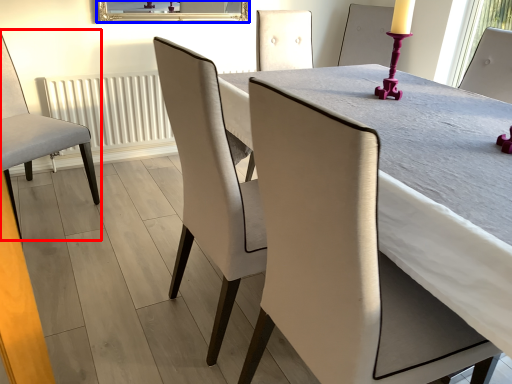
Question: Which object appears farthest to the camera in this image, chair (highlighted by a red box) or mirror (highlighted by a blue box)?

Choices:
 (A) chair
 (B) mirror

Answer: (B)